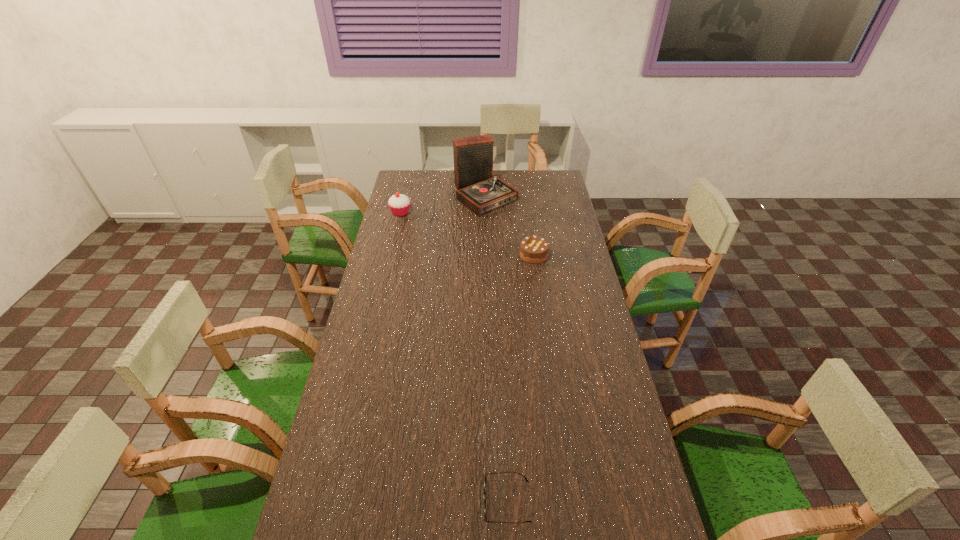
Locate an element on the screen. vacant area situated on the front-facing side of the nearest object is located at coordinates (444, 501).

Where is `vacant space located 0.250m on the front-facing side of the nearest object`? vacant space located 0.250m on the front-facing side of the nearest object is located at coordinates (385, 501).

Where is `vacant space located on the front-facing side of the nearest object`? vacant space located on the front-facing side of the nearest object is located at coordinates (385, 501).

Where is `object present at the far edge`? object present at the far edge is located at coordinates (477, 188).

I want to click on object at the left edge, so click(399, 204).

The width and height of the screenshot is (960, 540). I want to click on object located at the right edge, so click(x=533, y=249).

Where is `free region at the far edge`? free region at the far edge is located at coordinates (453, 186).

At what (x,y) coordinates should I click in order to perform the action: click on vacant space at the left edge of the desktop. Please return your answer as a coordinate pair (x, y). Looking at the image, I should click on (305, 529).

Identify the location of free space at the right edge of the desktop. (616, 371).

Identify the location of empty space that is in between the spectacles and the third farthest object. The width and height of the screenshot is (960, 540). (520, 378).